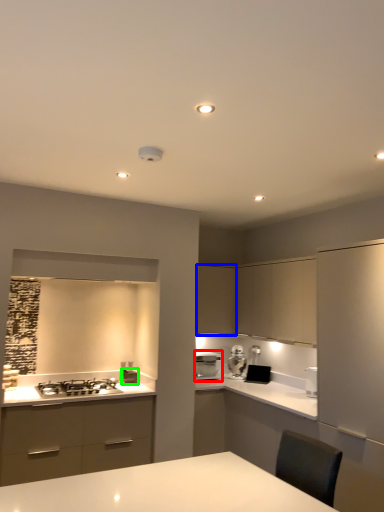
Question: Based on their relative distances, which object is farther from home appliance (highlighted by a red box)? Choose from cabinetry (highlighted by a blue box) and appliance (highlighted by a green box).

Choices:
 (A) cabinetry
 (B) appliance

Answer: (B)